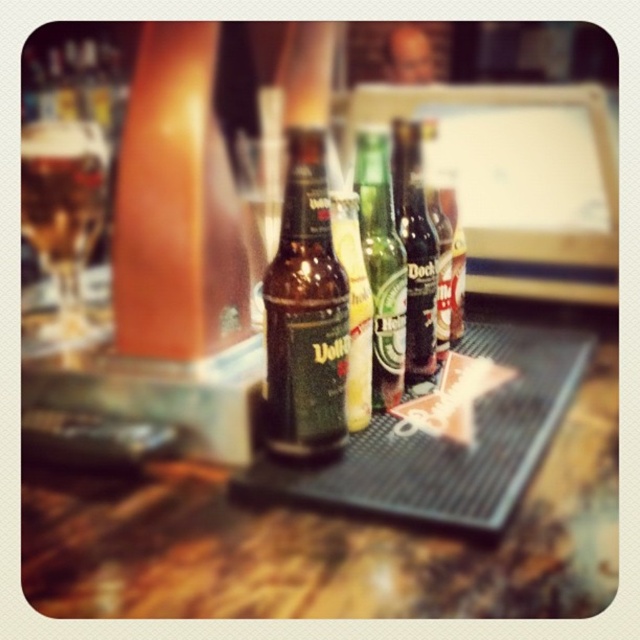
Is black rubber mat at center taller than green glass bottle at center?

Incorrect, black rubber mat at center's height is not larger of green glass bottle at center's.

Is black rubber mat at center behind green glass bottle at center?

No, black rubber mat at center is closer to the viewer.

Is point (310, 611) behind point (400, 243)?

No, it is in front of (400, 243).

You are a GUI agent. You are given a task and a screenshot of the screen. Output one action in this format:
    pyautogui.click(x=<x>, y=<y>)
    Task: Click on the black rubber mat at center
    This screenshot has height=640, width=640.
    Given the screenshot: What is the action you would take?
    pyautogui.click(x=336, y=531)

Who is lower down, brown glass bottle at center or dark brown glass bottle at center?

brown glass bottle at center is lower down.

Who is more distant from viewer, (x=333, y=445) or (x=422, y=321)?

Point (x=422, y=321)

Between point (296, 150) and point (419, 168), which one is positioned in front?

Point (296, 150) is in front.

Image resolution: width=640 pixels, height=640 pixels. Identify the location of brown glass bottle at center. (305, 314).

Describe the element at coordinates (381, 264) in the screenshot. This screenshot has width=640, height=640. I see `green glass bottle at center` at that location.

Does green glass bottle at center appear under dark brown glass bottle at center?

Yes.

Between point (392, 340) and point (397, 170), which one is positioned behind?

Positioned behind is point (397, 170).

Identify the location of green glass bottle at center. The height and width of the screenshot is (640, 640). tap(381, 264).